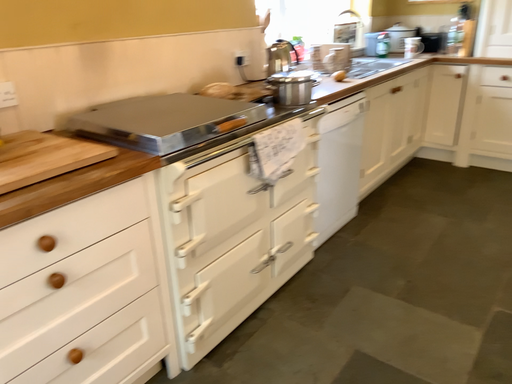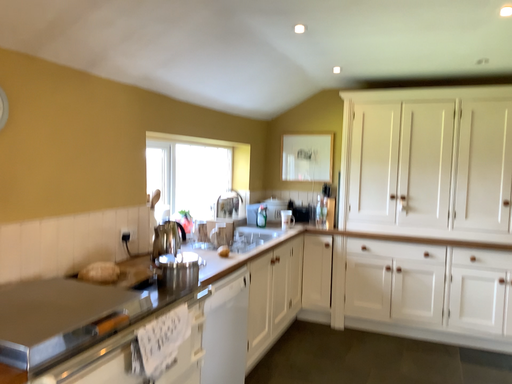
Question: How did the camera likely rotate when shooting the video?

Choices:
 (A) rotated right
 (B) rotated left

Answer: (A)